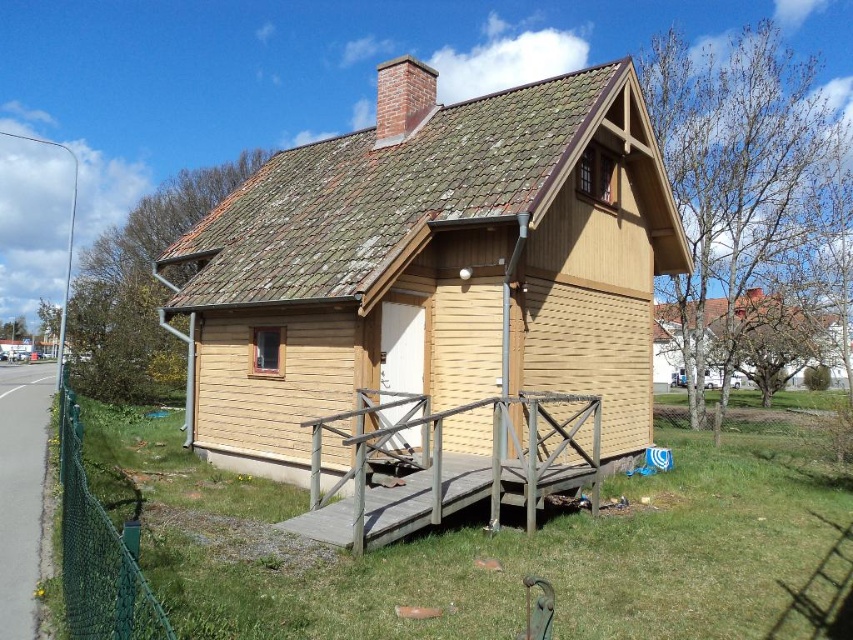
Question: Is green mesh fence at lower left thinner than yellow wood house at center?

Choices:
 (A) yes
 (B) no

Answer: (A)

Question: Is green mesh fence at lower left positioned in front of yellow wood house at center?

Choices:
 (A) no
 (B) yes

Answer: (B)

Question: Which point appears farthest from the camera in this image?

Choices:
 (A) (672, 380)
 (B) (428, 305)
 (C) (99, 572)

Answer: (A)

Question: Estimate the real-world distances between objects in this image. Which object is closer to the wooden at lower center?

Choices:
 (A) wooden cabin at center
 (B) green mesh fence at lower left

Answer: (A)

Question: From the image, what is the correct spatial relationship of wooden at lower center in relation to green mesh fence at lower left?

Choices:
 (A) right
 (B) left

Answer: (A)

Question: Among these objects, which one is nearest to the camera?

Choices:
 (A) green mesh fence at lower left
 (B) wooden cabin at center
 (C) wooden at lower center
 (D) yellow wood house at center

Answer: (A)